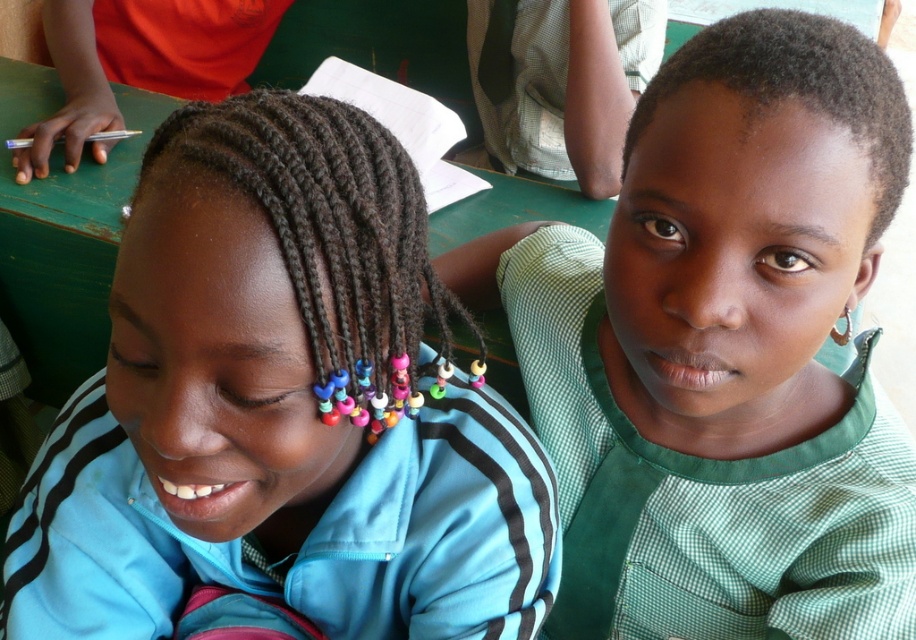
Question: Does green checkered shirt at upper right have a larger size compared to multicolored beaded braids at center?

Choices:
 (A) no
 (B) yes

Answer: (B)

Question: Which point appears farthest from the camera in this image?

Choices:
 (A) pyautogui.click(x=380, y=420)
 (B) pyautogui.click(x=710, y=496)

Answer: (B)

Question: Can you confirm if blue fabric shirt at center is positioned to the right of green checkered shirt at upper right?

Choices:
 (A) yes
 (B) no

Answer: (B)

Question: Estimate the real-world distances between objects in this image. Which object is closer to the multicolored beaded braids at center?

Choices:
 (A) blue fabric shirt at center
 (B) green checkered shirt at upper right

Answer: (A)

Question: Which of the following is the closest to the observer?

Choices:
 (A) (189, 157)
 (B) (778, 92)

Answer: (A)

Question: Does green checkered shirt at upper right appear on the right side of multicolored beaded braids at center?

Choices:
 (A) no
 (B) yes

Answer: (B)